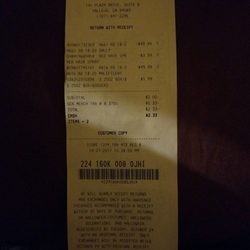
Identify the location of light. (208, 147).